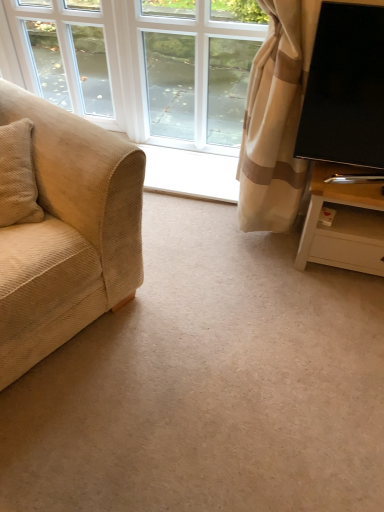
Question: Does point (102, 224) appear closer or farther from the camera than point (304, 262)?

Choices:
 (A) closer
 (B) farther

Answer: (A)

Question: Visually, is beige corduroy couch at left positioned to the left or to the right of white wood tv stand at right?

Choices:
 (A) left
 (B) right

Answer: (A)

Question: Estimate the real-world distances between objects in this image. Which object is closer to the white glass window at center, the 1th window viewed from the right?

Choices:
 (A) beige corduroy couch at left
 (B) white wood tv stand at right
 (C) white glass window at upper left, which is counted as the second window, starting from the right
 (D) black glossy tv at right

Answer: (C)

Question: Based on their relative distances, which object is nearer to the white wood tv stand at right?

Choices:
 (A) black glossy tv at right
 (B) beige corduroy couch at left
 (C) white glass window at center, the 1th window viewed from the right
 (D) white glass window at upper left, which is counted as the second window, starting from the right

Answer: (A)